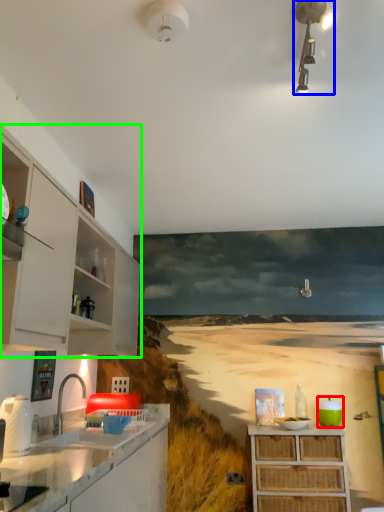
Question: Which is farther away from appliance (highlighted by a red box)? light fixture (highlighted by a blue box) or cabinetry (highlighted by a green box)?

Choices:
 (A) light fixture
 (B) cabinetry

Answer: (A)